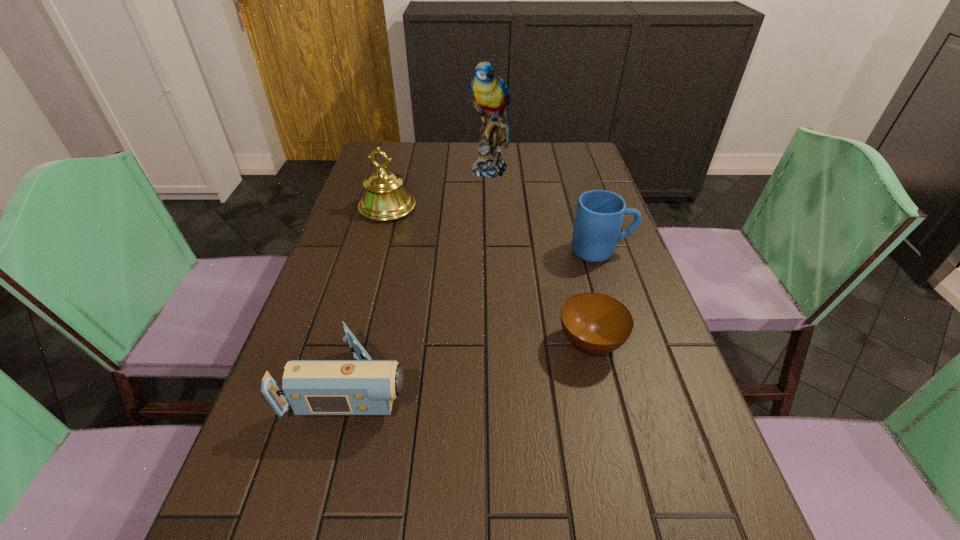
Locate an element on the screen. This screenshot has height=540, width=960. the third object from right to left is located at coordinates (491, 94).

Image resolution: width=960 pixels, height=540 pixels. I want to click on the farthest object, so click(491, 94).

You are a GUI agent. You are given a task and a screenshot of the screen. Output one action in this format:
    pyautogui.click(x=<x>, y=<y>)
    Task: Click on the bell
    The width and height of the screenshot is (960, 540).
    Given the screenshot: What is the action you would take?
    pyautogui.click(x=385, y=198)

This screenshot has width=960, height=540. I want to click on the fourth nearest object, so click(x=385, y=198).

Find the location of a particular element. The image size is (960, 540). mug is located at coordinates (599, 216).

In order to click on the third nearest object in this screenshot , I will do `click(599, 216)`.

Locate an element on the screen. The image size is (960, 540). the second shortest object is located at coordinates tap(364, 387).

I want to click on the shortest object, so click(594, 323).

Find the location of `vacant space located on the face of the tallest object`. vacant space located on the face of the tallest object is located at coordinates (492, 244).

The image size is (960, 540). Find the location of `free space located on the front of the bell`. free space located on the front of the bell is located at coordinates (367, 282).